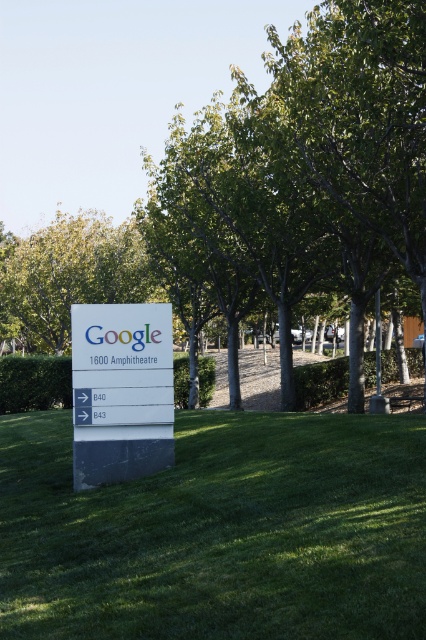
Question: Does white plastic sign at center have a larger size compared to green leafy tree at upper center?

Choices:
 (A) yes
 (B) no

Answer: (B)

Question: Which object appears farthest from the camera in this image?

Choices:
 (A) green leafy tree at center
 (B) green leafy tree at upper center
 (C) green grass at center

Answer: (B)

Question: Does green leafy tree at center appear under white plastic sign at center?

Choices:
 (A) yes
 (B) no

Answer: (B)

Question: Is white plastic sign at center to the right of green leafy tree at upper center from the viewer's perspective?

Choices:
 (A) yes
 (B) no

Answer: (A)

Question: Among these points, which one is nearest to the camera?

Choices:
 (A) (75, 291)
 (B) (402, 422)
 (C) (71, 312)
 (D) (351, 29)

Answer: (B)

Question: Which of these objects is positioned farthest from the white plastic sign at center?

Choices:
 (A) green leafy tree at center
 (B) green leafy tree at upper center

Answer: (B)